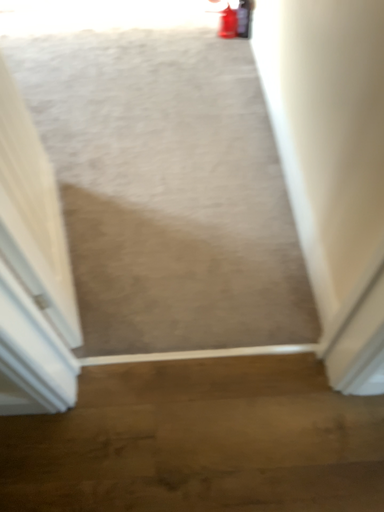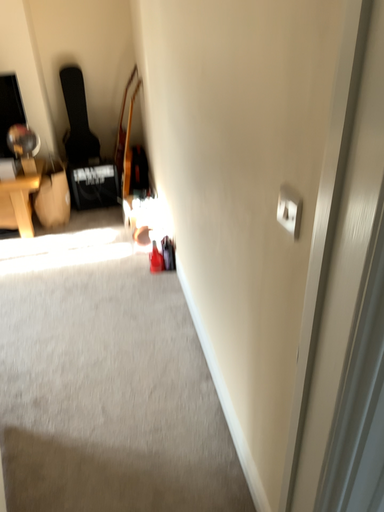
Question: Which way did the camera rotate in the video?

Choices:
 (A) rotated downward
 (B) rotated upward

Answer: (B)